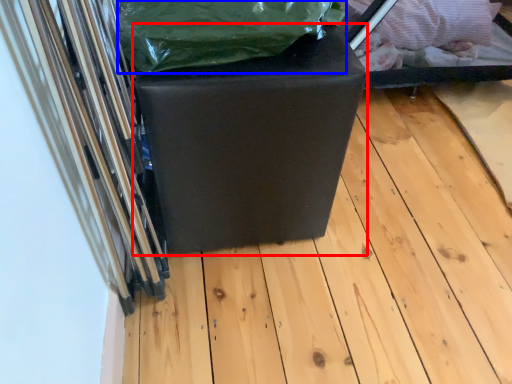
Question: Which object appears closest to the camera in this image, furniture (highlighted by a red box) or waste (highlighted by a blue box)?

Choices:
 (A) furniture
 (B) waste

Answer: (B)